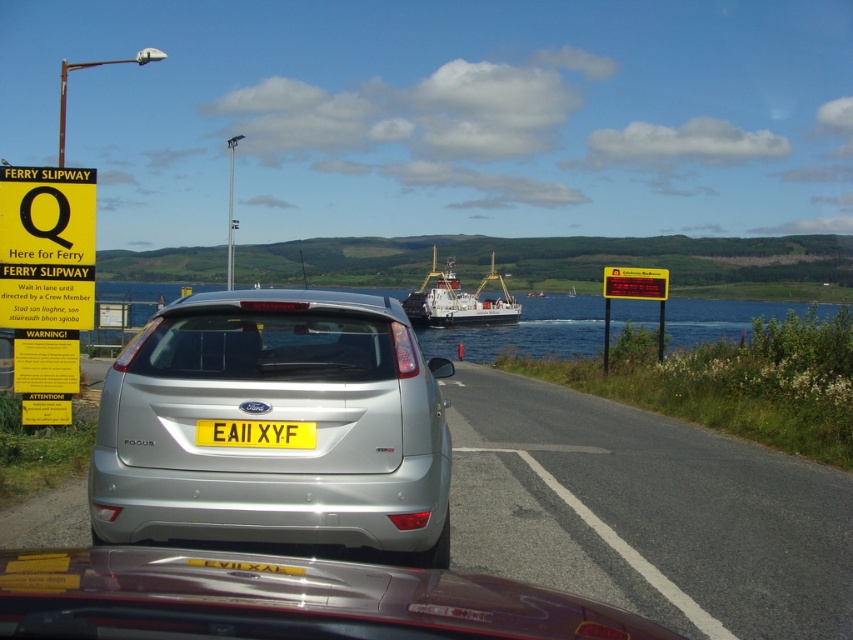
You are standing at the ferry slipway and want to board the ferry. The silver metallic hatchback at center is blocking your path. Can you walk around it without crossing the road? The road is 5 meters wide.

The silver metallic hatchback at center is 4.14 meters away from you. Since the road is 5 meters wide, you can walk around it on either side without crossing the road.

You are a driver approaching the ferry slipway and see the silver metallic hatchback at center and the asphalt road at center. Which object is positioned higher in the image?

The silver metallic hatchback at center is positioned higher than the asphalt road at center.

You are standing at the ferry slipway and need to walk to the car that is parked at point (584, 400). However, there is an obstacle at point (225, 307). Can you walk around the obstacle to reach the car?

Yes, you can walk around the obstacle at point (225, 307) because it is in front of the car at point (584, 400), meaning the obstacle is closer to you and you can navigate around it to reach the car.